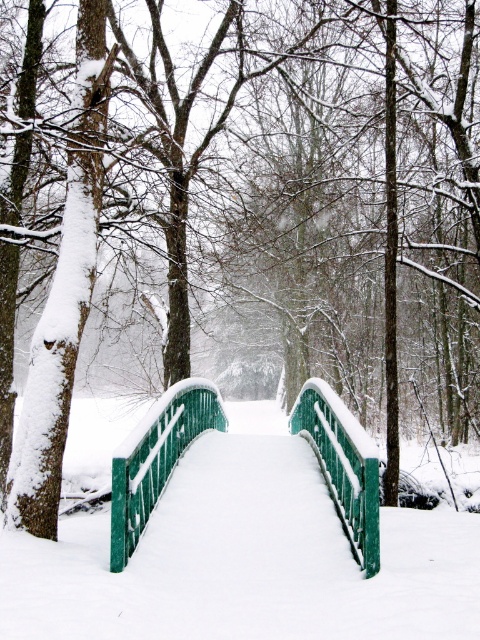
Question: Does green painted wood bridge at center have a lesser width compared to green matte bridge at center?

Choices:
 (A) no
 (B) yes

Answer: (A)

Question: Which of the following is the farthest from the observer?

Choices:
 (A) green matte bridge at center
 (B) green painted wood rail at center
 (C) green painted metal railing at center
 (D) green painted wood bridge at center

Answer: (C)

Question: Which point is farther from the camera taking this photo?

Choices:
 (A) (359, 520)
 (B) (362, 545)
 (C) (196, 380)

Answer: (C)

Question: Can you confirm if green painted metal railing at center is positioned to the right of green painted wood rail at center?

Choices:
 (A) no
 (B) yes

Answer: (A)

Question: Can you confirm if green painted metal railing at center is positioned to the left of green painted wood rail at center?

Choices:
 (A) yes
 (B) no

Answer: (A)

Question: Which of the following is the farthest from the observer?

Choices:
 (A) green painted metal railing at center
 (B) green painted wood rail at center

Answer: (A)